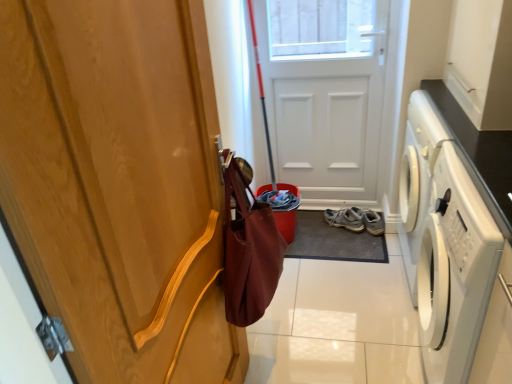
Where is `vacant space positioned to the left of light brown suede sneakers at lower center`? This screenshot has height=384, width=512. vacant space positioned to the left of light brown suede sneakers at lower center is located at coordinates (322, 229).